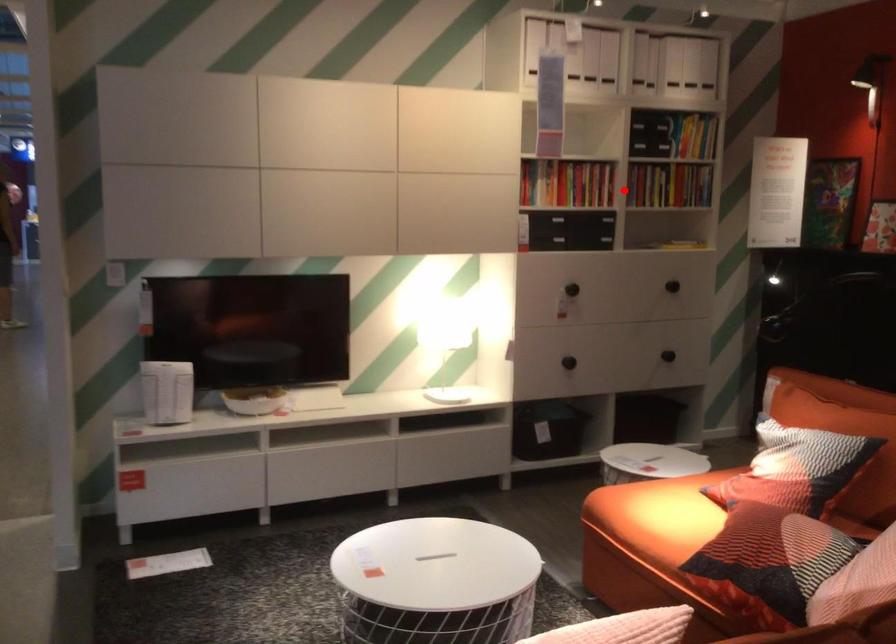
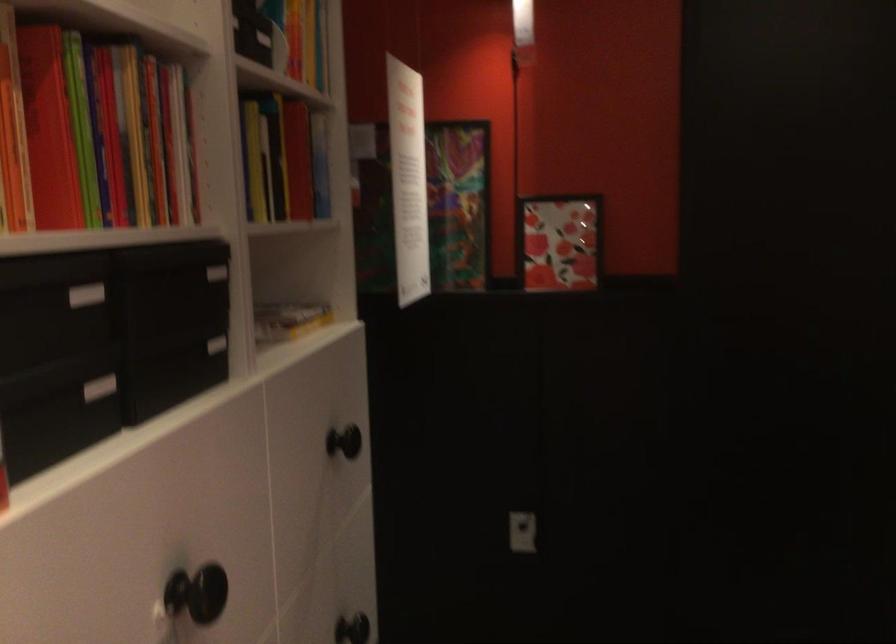
Question: I am providing you with two images of the same scene from different viewpoints. A red point is shown in image1. For the corresponding object point in image2, is it positioned nearer or farther from the camera?

Choices:
 (A) Nearer
 (B) Farther

Answer: (A)